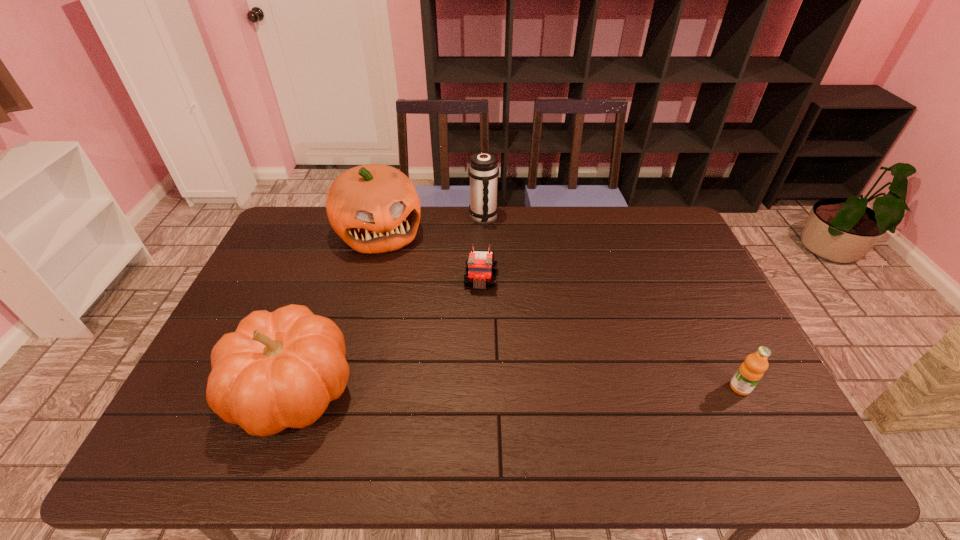
Find the location of a particular element. This screenshot has width=960, height=540. free space between the farther pumpkin and the thermos bottle is located at coordinates (432, 225).

Locate an element on the screen. Image resolution: width=960 pixels, height=540 pixels. vacant area that lies between the nearer pumpkin and the farther pumpkin is located at coordinates (336, 311).

Where is `blank region between the fourth tallest object and the nearer pumpkin`? blank region between the fourth tallest object and the nearer pumpkin is located at coordinates (516, 388).

You are a GUI agent. You are given a task and a screenshot of the screen. Output one action in this format:
    pyautogui.click(x=<x>, y=<y>)
    Task: Click on the free point between the nearer pumpkin and the thermos bottle
    The image size is (960, 540).
    Given the screenshot: What is the action you would take?
    pyautogui.click(x=388, y=304)

What are the coordinates of `free area in between the third farthest object and the thermos bottle` in the screenshot? It's located at (482, 249).

The width and height of the screenshot is (960, 540). Identify the location of free spot between the rightmost object and the farther pumpkin. (560, 310).

Image resolution: width=960 pixels, height=540 pixels. In order to click on blank region between the Lego and the farther pumpkin in this screenshot , I will do `click(430, 256)`.

Locate an element on the screen. The width and height of the screenshot is (960, 540). vacant point located between the orange juice and the farther pumpkin is located at coordinates (560, 310).

Locate an element on the screen. The image size is (960, 540). free space between the shortest object and the farther pumpkin is located at coordinates (430, 256).

Find the location of a particular element. This screenshot has height=540, width=960. the third closest object to the third nearest object is located at coordinates (280, 369).